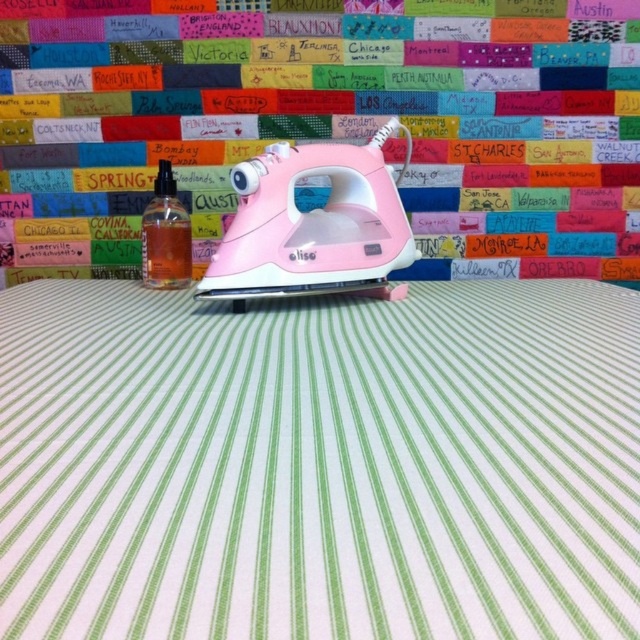
You are a tailor working on the white striped fabric at center and the translucent orange liquid at center. You need to place a hot iron on the fabric without spilling the liquid. Where should you position the iron?

The white striped fabric at center is below the translucent orange liquid at center, so you should position the iron on the white striped fabric at center to avoid spilling the translucent orange liquid at center.

You are an ironing expert who wants to press the white striped fabric at center using the translucent orange liquid at center. Can you pour the liquid directly onto the fabric without spilling over the edges?

The translucent orange liquid at center is taller than white striped fabric at center, so pouring the liquid directly onto the fabric may cause it to spill over the edges since the liquid is higher than the fabric.